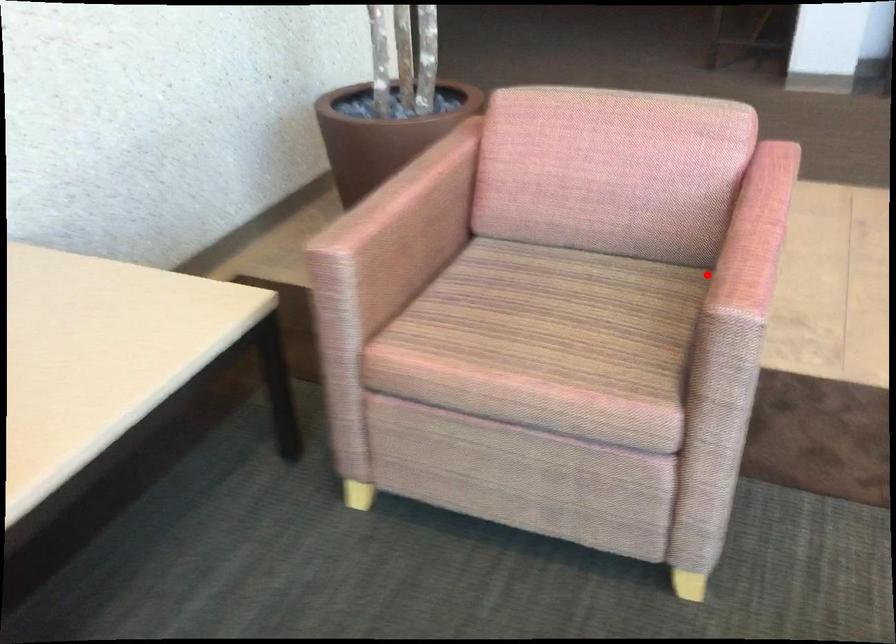
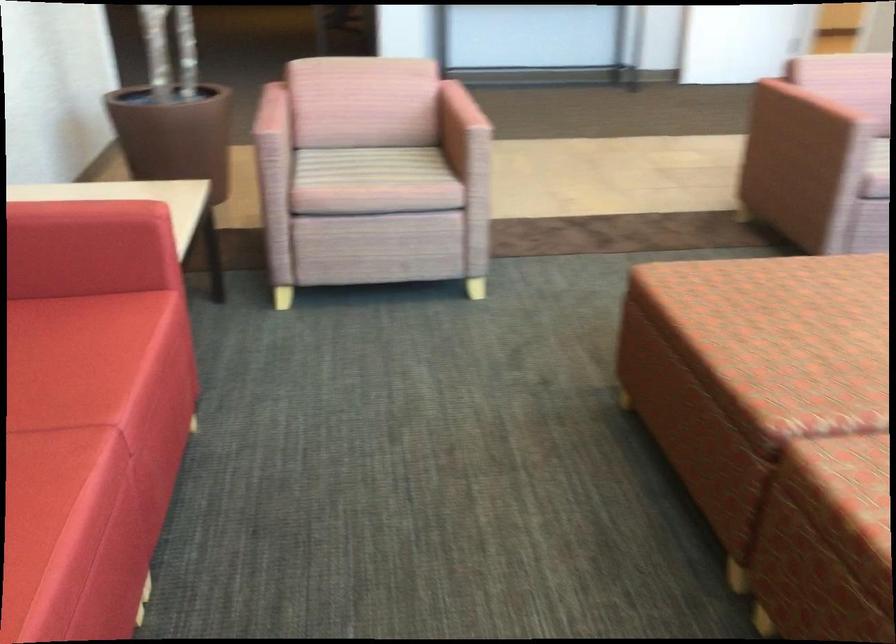
The point at the highlighted location is marked in the first image. Where is the corresponding point in the second image?

(459, 118)